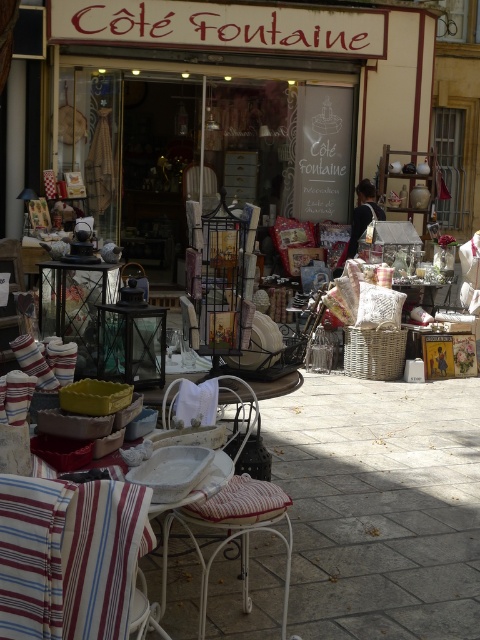
Question: Is striped fabric cushion at lower left below white wicker chair at center?

Choices:
 (A) yes
 (B) no

Answer: (B)

Question: Estimate the real-world distances between objects in this image. Which object is closer to the white striped fabric at lower left?

Choices:
 (A) white wicker chair at center
 (B) striped fabric cushion at lower left

Answer: (B)

Question: Which object appears farthest from the camera in this image?

Choices:
 (A) striped fabric cushion at lower left
 (B) white wicker chair at center
 (C) white striped fabric at lower left

Answer: (B)

Question: Is striped fabric cushion at lower left smaller than white striped fabric at lower left?

Choices:
 (A) no
 (B) yes

Answer: (B)

Question: Does white wicker chair at center come in front of white striped fabric at lower left?

Choices:
 (A) no
 (B) yes

Answer: (A)

Question: Which object is farther from the camera taking this photo?

Choices:
 (A) white wicker chair at center
 (B) striped fabric cushion at lower left

Answer: (A)